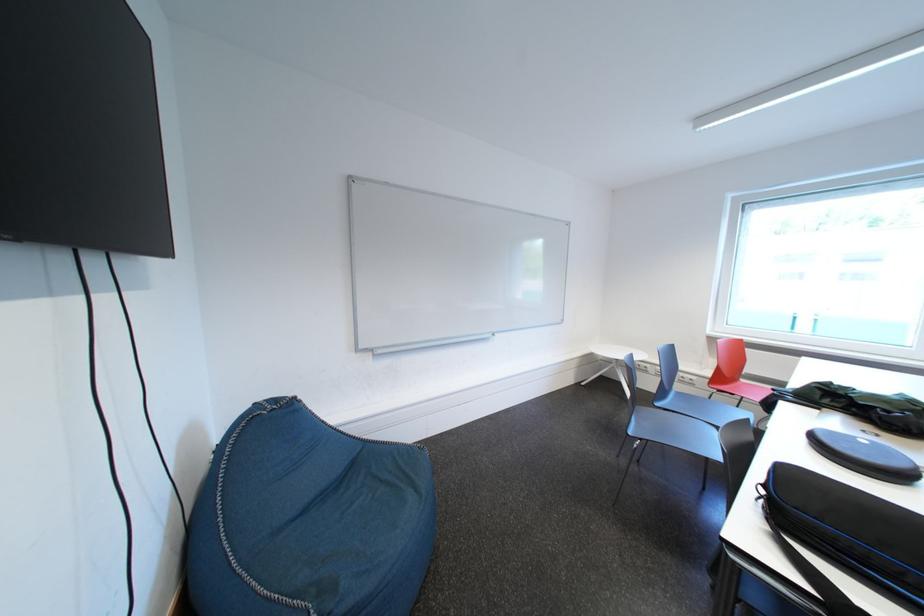
Identify the location of whiteboard marker tray. (431, 342).